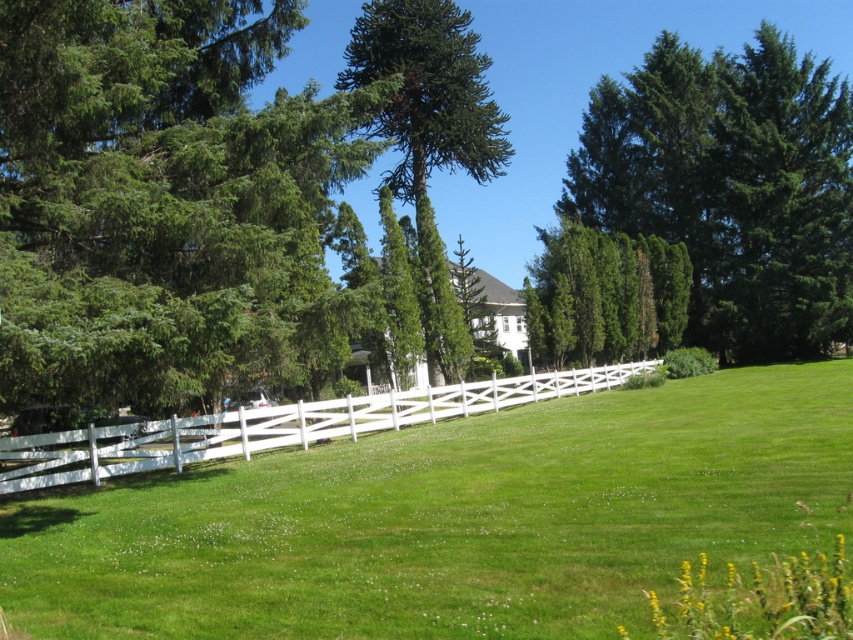
Question: Is green grassy field at center closer to the viewer compared to white wooden fence at lower center?

Choices:
 (A) yes
 (B) no

Answer: (A)

Question: Is green grassy field at center bigger than white wooden fence at lower center?

Choices:
 (A) no
 (B) yes

Answer: (A)

Question: Which point appears closest to the camera in this image?

Choices:
 (A) (567, 339)
 (B) (531, 564)

Answer: (B)

Question: Estimate the real-world distances between objects in this image. Which object is closer to the green textured tree at upper right?

Choices:
 (A) green grassy field at center
 (B) green textured hedge at center
 (C) white wooden fence at lower center

Answer: (B)

Question: Is the position of white wooden fence at lower center more distant than that of green textured hedge at center?

Choices:
 (A) no
 (B) yes

Answer: (A)

Question: Which point is closer to the camera taking this photo?

Choices:
 (A) (51, 548)
 (B) (167, 452)
 (C) (788, 234)
 (D) (573, 310)

Answer: (A)